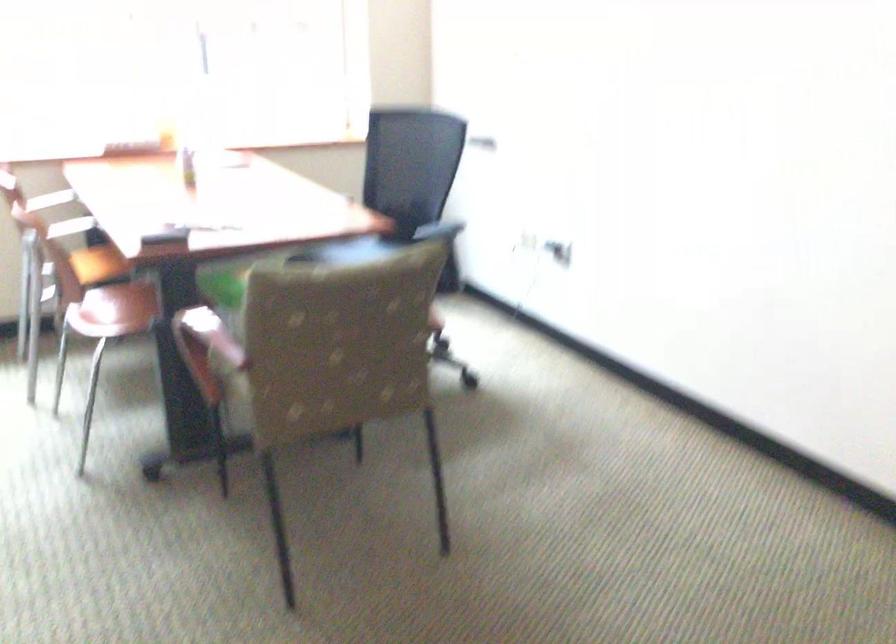
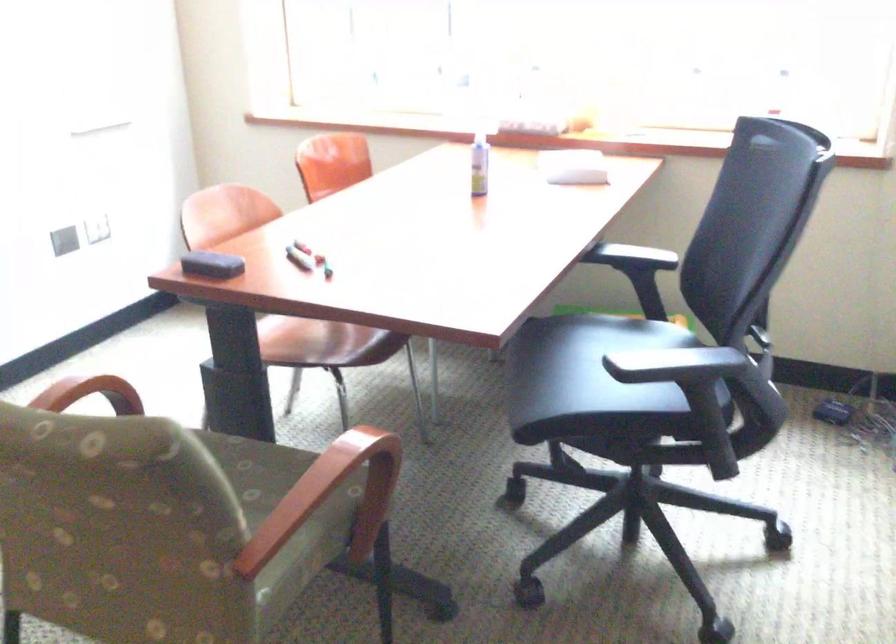
In the second image, find the point that corresponds to (193,220) in the first image.

(299, 258)